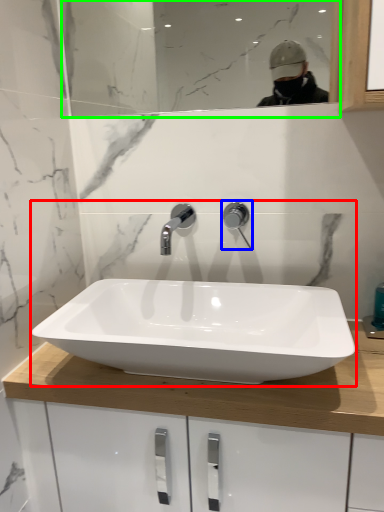
Question: Considering the real-world distances, which object is closest to sink (highlighted by a red box)? tap (highlighted by a blue box) or mirror (highlighted by a green box).

Choices:
 (A) tap
 (B) mirror

Answer: (A)